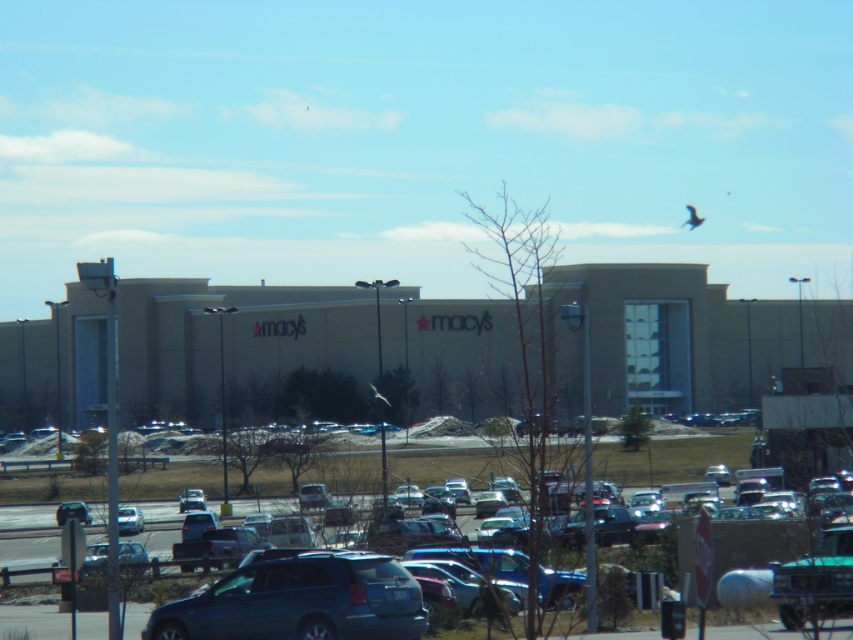
Question: Does metallic gray cars at center have a larger size compared to matte silver sedan at lower left?

Choices:
 (A) no
 (B) yes

Answer: (B)

Question: Which of these objects is positioned closest to the metallic silver car at lower left?

Choices:
 (A) metallic gray cars at center
 (B) metallic blue suv at center

Answer: (A)

Question: Among these points, which one is farthest from the camera?

Choices:
 (A) (62, 518)
 (B) (6, 611)
 (C) (140, 520)

Answer: (A)

Question: Can you confirm if metallic blue suv at center is bigger than metallic silver car at lower left?

Choices:
 (A) yes
 (B) no

Answer: (B)

Question: Is metallic blue suv at center below metallic silver car at lower left?

Choices:
 (A) no
 (B) yes

Answer: (A)

Question: Which point appears farthest from the camera in this image?

Choices:
 (A) (685, 289)
 (B) (90, 522)
 (C) (102, 612)

Answer: (A)